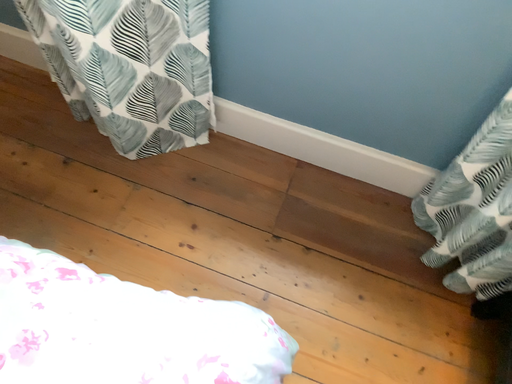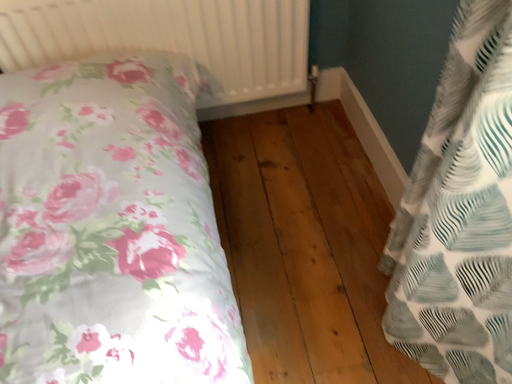
Question: How did the camera likely rotate when shooting the video?

Choices:
 (A) rotated downward
 (B) rotated upward

Answer: (B)